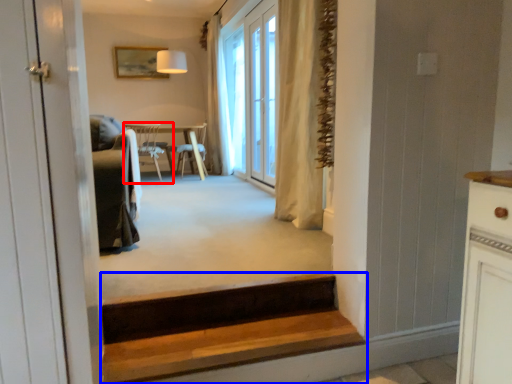
Question: Which of the following is the closest to the observer, chair (highlighted by a red box) or stairs (highlighted by a blue box)?

Choices:
 (A) chair
 (B) stairs

Answer: (B)